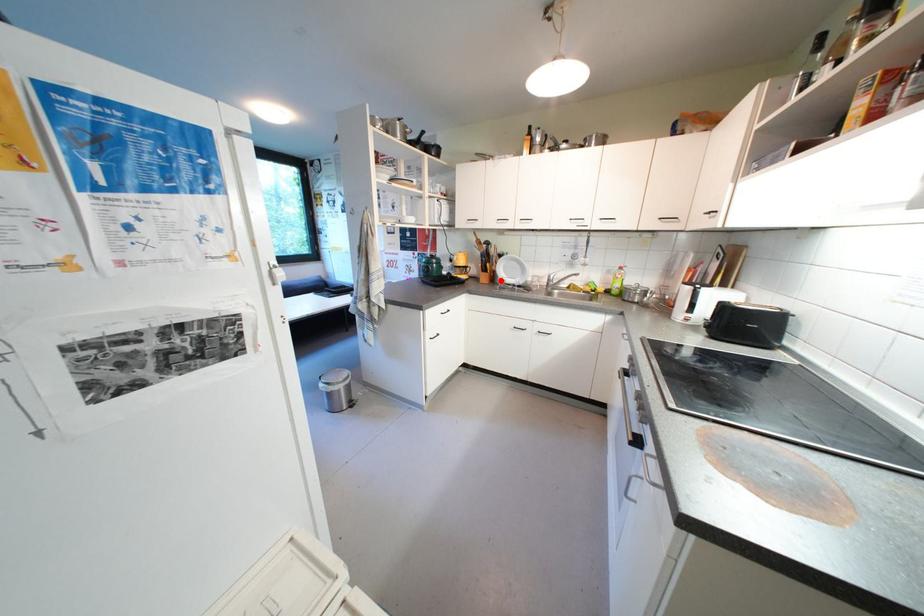
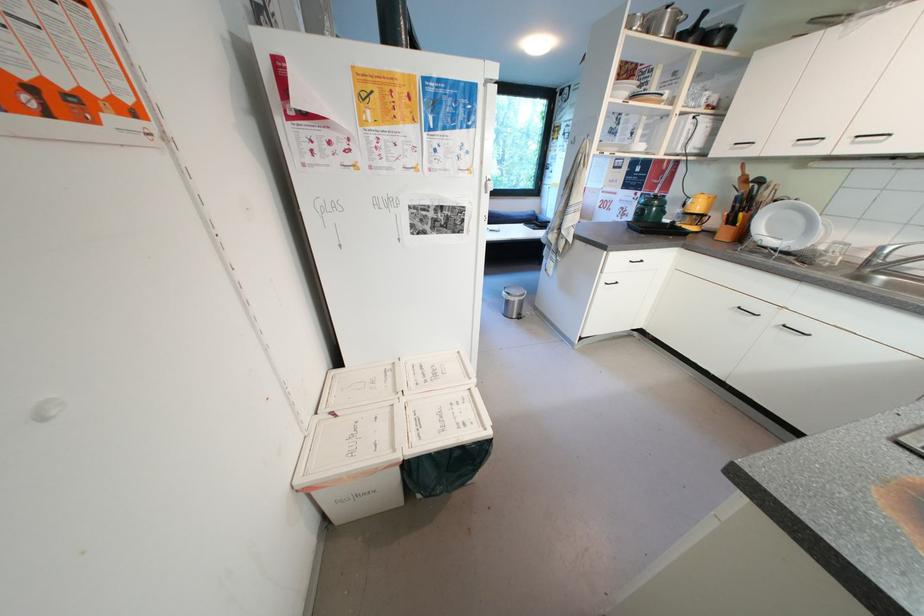
Locate, in the second image, the point that corresponds to the highlighted location in the first image.

(749, 238)